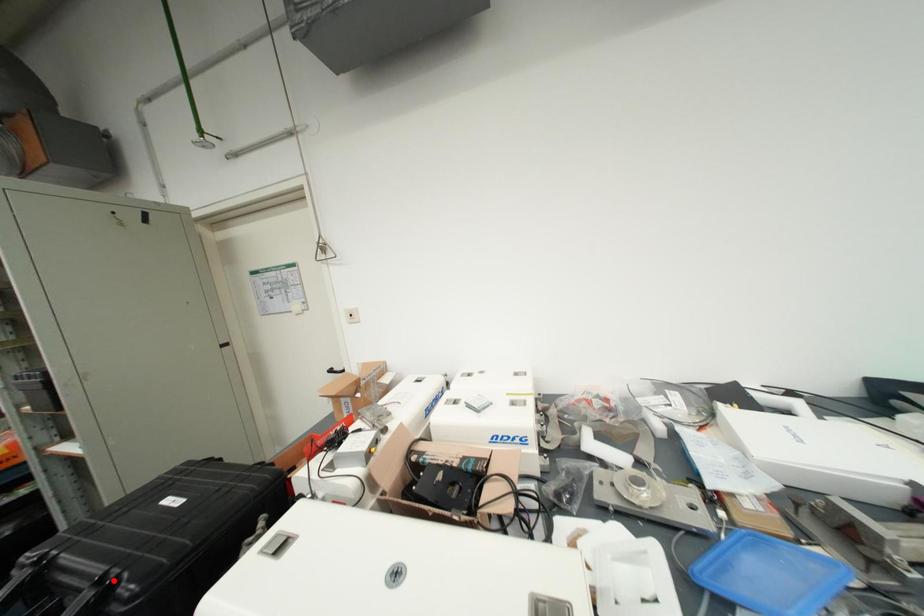
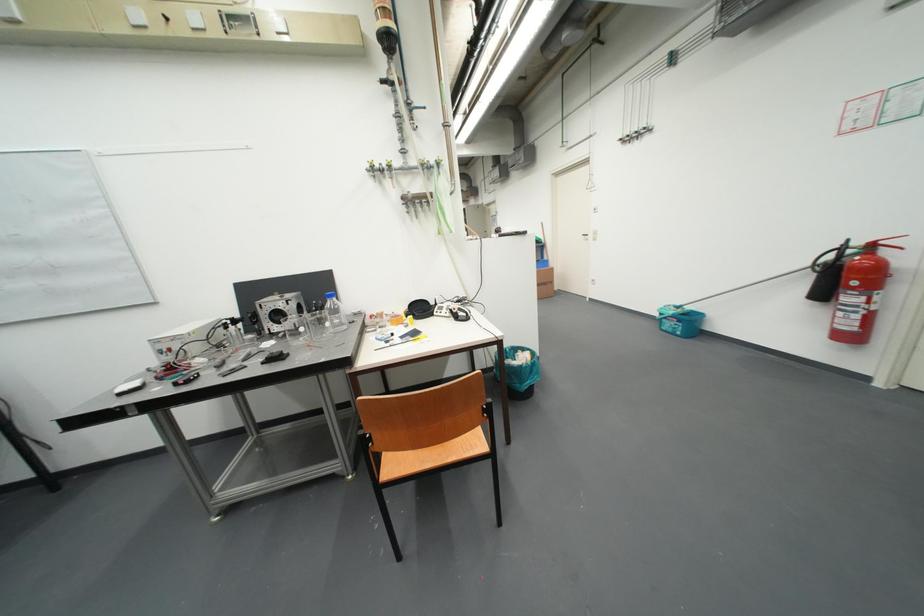
Question: I am providing you with two images of the same scene from different viewpoints. A red point is marked on the first image. At the location where the point appears in image 1, is it still visible in image 2?

Choices:
 (A) Yes
 (B) No

Answer: (B)